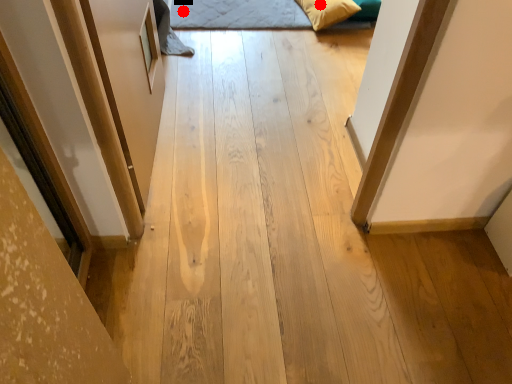
Question: Two points are circled on the image, labeled by A and B beside each circle. Which point is closer to the camera?

Choices:
 (A) A is closer
 (B) B is closer

Answer: (B)